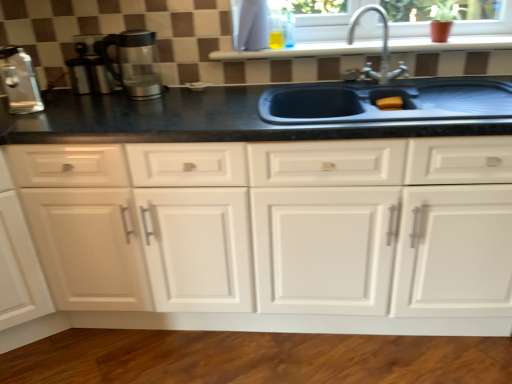
In order to face transparent glass coffee maker at left, which is the second coffee machine from left to right, should I rotate leftwards or rightwards?

You should rotate left by 15.775 degrees.

This screenshot has width=512, height=384. I want to click on white matte cabinet at center, so click(293, 224).

Image resolution: width=512 pixels, height=384 pixels. Describe the element at coordinates (326, 23) in the screenshot. I see `white plastic window frame at upper center` at that location.

How much space does satin silver coffee machine at left, positioned as the 1th coffee machine in left-to-right order, occupy horizontally?

satin silver coffee machine at left, positioned as the 1th coffee machine in left-to-right order, is 5.60 inches wide.

At what (x,y) coordinates should I click in order to perform the action: click on white glossy window sill at upper center. Please return your answer as a coordinate pair (x, y). Looking at the image, I should click on (303, 51).

What do you see at coordinates (303, 51) in the screenshot?
I see `white glossy window sill at upper center` at bounding box center [303, 51].

The height and width of the screenshot is (384, 512). What are the coordinates of `transparent glass coffee maker at left, which is the second coffee machine from left to right` in the screenshot? It's located at (133, 63).

This screenshot has height=384, width=512. I want to click on tap above the transparent glass coffee maker at left, which is the first coffee machine from right to left (from the image's perspective), so click(382, 50).

Are satin nickel faucet at upper right and transparent glass coffee maker at left, which is the second coffee machine from left to right, far apart?

Actually, satin nickel faucet at upper right and transparent glass coffee maker at left, which is the second coffee machine from left to right, are a little close together.

Between point (383, 49) and point (120, 74), which one is positioned in front?

The point (383, 49) is closer to the camera.

In terms of height, does satin nickel faucet at upper right look taller or shorter compared to transparent glass coffee maker at left, which is the first coffee machine from right to left?

In the image, satin nickel faucet at upper right appears to be taller than transparent glass coffee maker at left, which is the first coffee machine from right to left.

Between satin nickel faucet at upper right and white glossy window sill at upper center, which one is positioned behind?

white glossy window sill at upper center is further away from the camera.

Considering the sizes of objects satin nickel faucet at upper right and white glossy window sill at upper center in the image provided, who is wider, satin nickel faucet at upper right or white glossy window sill at upper center?

Wider between the two is white glossy window sill at upper center.

Does satin nickel faucet at upper right turn towards white glossy window sill at upper center?

No, satin nickel faucet at upper right is not oriented towards white glossy window sill at upper center.

Between point (403, 66) and point (467, 39), which one is positioned behind?

The point (403, 66) is farther.

Is satin nickel faucet at upper right wider or thinner than white plastic window frame at upper center?

satin nickel faucet at upper right is wider than white plastic window frame at upper center.

Could you tell me if satin nickel faucet at upper right is facing white plastic window frame at upper center?

No, satin nickel faucet at upper right is not oriented towards white plastic window frame at upper center.

What's the angular difference between satin nickel faucet at upper right and white plastic window frame at upper center's facing directions?

There is a 28.8-degree angle between the facing directions of satin nickel faucet at upper right and white plastic window frame at upper center.

Would you say white plastic window frame at upper center is part of satin nickel faucet at upper right's contents?

No, satin nickel faucet at upper right does not contain white plastic window frame at upper center.

Is black matte sink at center at the left side of white plastic window frame at upper center?

Yes.

Is black matte sink at center beside white plastic window frame at upper center?

black matte sink at center and white plastic window frame at upper center are not in contact.

Is point (375, 107) behind point (474, 9)?

That is False.

Can you confirm if black matte sink at center is smaller than white plastic window frame at upper center?

Incorrect, black matte sink at center is not smaller in size than white plastic window frame at upper center.

Is black matte sink at center surrounded by satin nickel faucet at upper right?

No, satin nickel faucet at upper right does not contain black matte sink at center.

Between satin nickel faucet at upper right and black matte sink at center, which one appears on the right side from the viewer's perspective?

black matte sink at center.

The height and width of the screenshot is (384, 512). Identify the location of tap behind the black matte sink at center. (382, 50).

From a real-world perspective, is satin nickel faucet at upper right under black matte sink at center?

No, from a real-world perspective, satin nickel faucet at upper right is not beneath black matte sink at center.

You are a GUI agent. You are given a task and a screenshot of the screen. Output one action in this format:
    pyautogui.click(x=<x>, y=<y>)
    Task: Click on the sink lying below the transparent glass coffee maker at left, which is the second coffee machine from left to right (from the image's perspective)
    The width and height of the screenshot is (512, 384).
    Given the screenshot: What is the action you would take?
    pyautogui.click(x=385, y=97)

What's the angular difference between black matte sink at center and transparent glass coffee maker at left, which is the first coffee machine from right to left,'s facing directions?

1.43 degrees.

Is transparent glass coffee maker at left, which is the first coffee machine from right to left, located within black matte sink at center?

No, transparent glass coffee maker at left, which is the first coffee machine from right to left, is not inside black matte sink at center.

From a real-world perspective, which is physically below, black matte sink at center or transparent glass coffee maker at left, which is the second coffee machine from left to right?

black matte sink at center.

Visually, is transparent glass coffee maker at left, which is the first coffee machine from right to left, positioned to the left or to the right of white plastic window frame at upper center?

transparent glass coffee maker at left, which is the first coffee machine from right to left, is positioned on white plastic window frame at upper center's left side.

Considering the positions of point (122, 40) and point (362, 30), is point (122, 40) closer or farther from the camera than point (362, 30)?

Point (122, 40) is closer to the camera than point (362, 30).

Considering the sizes of objects transparent glass coffee maker at left, which is the second coffee machine from left to right, and white plastic window frame at upper center in the image provided, who is bigger, transparent glass coffee maker at left, which is the second coffee machine from left to right, or white plastic window frame at upper center?

white plastic window frame at upper center.

The image size is (512, 384). I want to click on coffee machine that is the 2nd object located behind the satin nickel faucet at upper right, so click(133, 63).

The height and width of the screenshot is (384, 512). Find the location of `tap that appears above the white glossy window sill at upper center (from a real-world perspective)`. tap that appears above the white glossy window sill at upper center (from a real-world perspective) is located at coordinates (382, 50).

Considering their positions, is white matte cabinet at center positioned further to satin silver coffee machine at left, the second coffee machine viewed from the right, than transparent glass coffee maker at left, which is the second coffee machine from left to right?

Among the two, white matte cabinet at center is located further to satin silver coffee machine at left, the second coffee machine viewed from the right.

Which object lies nearer to the anchor point satin nickel faucet at upper right, white plastic window frame at upper center or black matte sink at center?

white plastic window frame at upper center lies closer to satin nickel faucet at upper right than the other object.

From the image, which object appears to be farther from white plastic window frame at upper center, satin nickel faucet at upper right or white glossy window sill at upper center?

satin nickel faucet at upper right lies further to white plastic window frame at upper center than the other object.

Which object lies nearer to the anchor point white glossy window sill at upper center, black matte sink at center or satin nickel faucet at upper right?

Based on the image, satin nickel faucet at upper right appears to be nearer to white glossy window sill at upper center.

Consider the image. Which object lies further to the anchor point white glossy window sill at upper center, white plastic window frame at upper center or white matte cabinet at center?

Among the two, white matte cabinet at center is located further to white glossy window sill at upper center.

Based on their spatial positions, is white matte cabinet at center or satin nickel faucet at upper right further from transparent glass coffee maker at left, which is the first coffee machine from right to left?

Among the two, satin nickel faucet at upper right is located further to transparent glass coffee maker at left, which is the first coffee machine from right to left.

Estimate the real-world distances between objects in this image. Which object is further from satin silver coffee machine at left, the second coffee machine viewed from the right, satin nickel faucet at upper right or black matte sink at center?

satin nickel faucet at upper right is further to satin silver coffee machine at left, the second coffee machine viewed from the right.

Considering their positions, is transparent glass coffee maker at left, which is the second coffee machine from left to right, positioned further to satin nickel faucet at upper right than satin silver coffee machine at left, positioned as the 1th coffee machine in left-to-right order?

The object further to satin nickel faucet at upper right is satin silver coffee machine at left, positioned as the 1th coffee machine in left-to-right order.

You are a GUI agent. You are given a task and a screenshot of the screen. Output one action in this format:
    pyautogui.click(x=<x>, y=<y>)
    Task: Click on the coffee machine between satin silver coffee machine at left, the second coffee machine viewed from the right, and satin nickel faucet at upper right, in the horizontal direction
    Image resolution: width=512 pixels, height=384 pixels.
    Given the screenshot: What is the action you would take?
    pyautogui.click(x=133, y=63)

Locate an element on the screen. sink between white plastic window frame at upper center and white matte cabinet at center vertically is located at coordinates (385, 97).

Image resolution: width=512 pixels, height=384 pixels. I want to click on tap located between transparent glass coffee maker at left, which is the second coffee machine from left to right, and black matte sink at center in the left-right direction, so click(382, 50).

Identify the location of window sill between transparent glass coffee maker at left, which is the second coffee machine from left to right, and black matte sink at center from left to right. Image resolution: width=512 pixels, height=384 pixels. (303, 51).